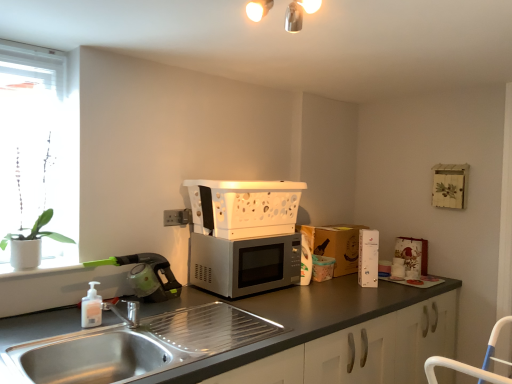
The width and height of the screenshot is (512, 384). Identify the location of free space in front of white matte soap dispenser at sink left. (78, 331).